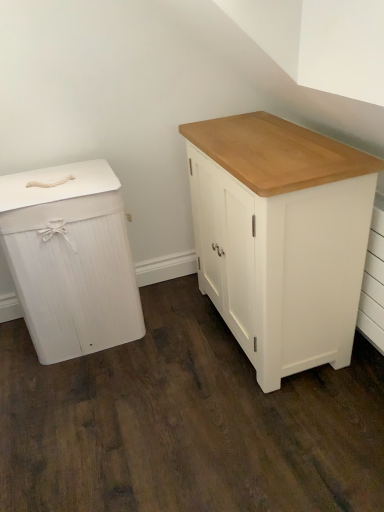
This screenshot has height=512, width=384. Identify the location of free location in front of white painted wood cabinet at center, the first chest of drawers viewed from the right. (263, 430).